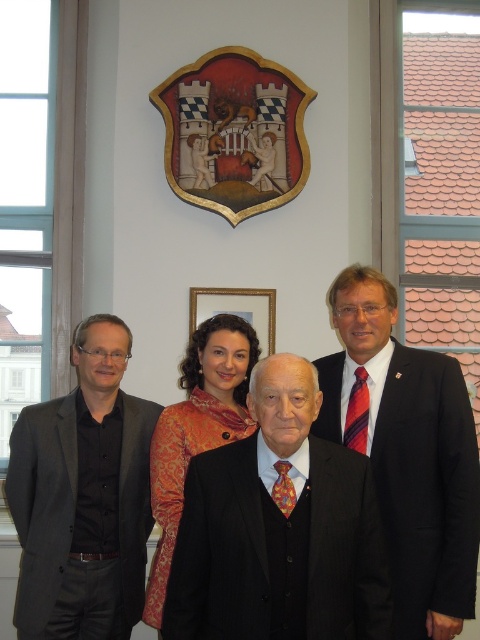
Between black pinstripe suit at center and wooden framed portrait at center, which one has more height?

black pinstripe suit at center

Who is lower down, black pinstripe suit at center or wooden framed portrait at center?

Positioned lower is black pinstripe suit at center.

In order to click on black pinstripe suit at center in this screenshot , I will do (208, 540).

Can you confirm if dark gray suit at left is wider than wooden shield at upper center?

Incorrect, dark gray suit at left's width does not surpass wooden shield at upper center's.

Between point (52, 541) and point (287, 148), which one is positioned behind?

Point (287, 148)

What do you see at coordinates (83, 497) in the screenshot? This screenshot has width=480, height=640. I see `dark gray suit at left` at bounding box center [83, 497].

Where is `dark gray suit at left`? The image size is (480, 640). dark gray suit at left is located at coordinates (83, 497).

Who is shorter, matte black suit at right or wooden shield at upper center?

wooden shield at upper center

Does point (317, 429) lie behind point (203, 141)?

No, (317, 429) is closer to viewer.

The width and height of the screenshot is (480, 640). Describe the element at coordinates (407, 452) in the screenshot. I see `matte black suit at right` at that location.

Find the location of a particular element. The height and width of the screenshot is (640, 480). matte black suit at right is located at coordinates (407, 452).